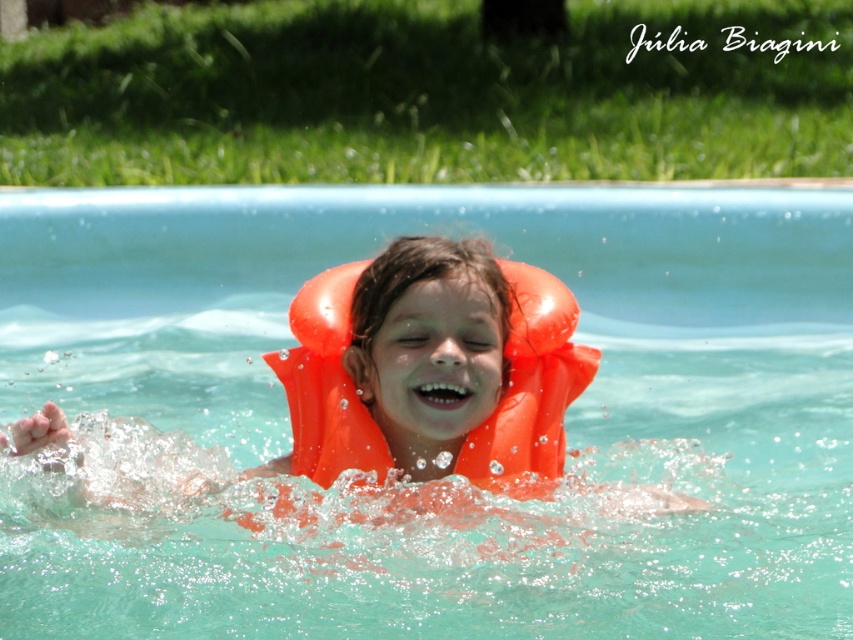
Between point (222, 600) and point (364, 467), which one is positioned in front?

Point (364, 467)

Identify the location of transparent plastic pool at center. This screenshot has width=853, height=640. 498,502.